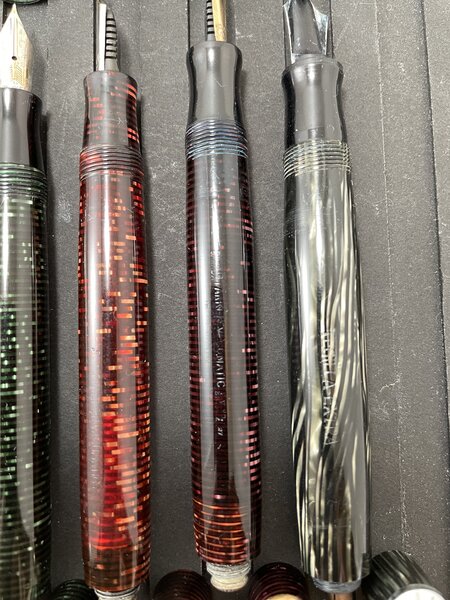
Where is `pens`? pens is located at coordinates (116, 400).